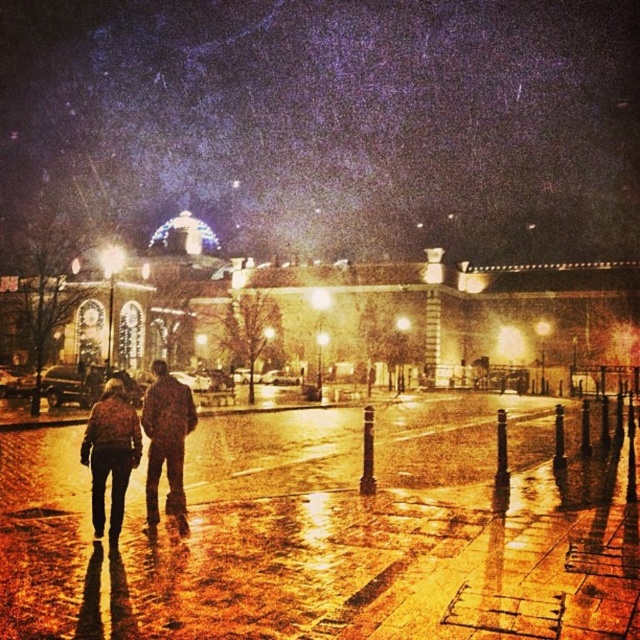
Find the location of a particular element. This screenshot has width=640, height=640. flannel shirt at center is located at coordinates (109, 454).

Can you confirm if flannel shirt at center is wider than dark brown leather jacket at center?

Correct, the width of flannel shirt at center exceeds that of dark brown leather jacket at center.

What do you see at coordinates (109, 454) in the screenshot? I see `flannel shirt at center` at bounding box center [109, 454].

This screenshot has width=640, height=640. I want to click on flannel shirt at center, so click(109, 454).

Who is taller, brown leather jacket at lower left or dark brown leather jacket at center?

dark brown leather jacket at center

Is brown leather jacket at lower left bigger than dark brown leather jacket at center?

Correct, brown leather jacket at lower left is larger in size than dark brown leather jacket at center.

Is point (136, 433) closer to camera compared to point (157, 392)?

That is True.

Locate an element on the screen. The width and height of the screenshot is (640, 640). brown leather jacket at lower left is located at coordinates click(109, 452).

Between flannel shirt at center and brown leather jacket at lower left, which one has more height?

flannel shirt at center

I want to click on flannel shirt at center, so click(109, 454).

Locate an element on the screen. flannel shirt at center is located at coordinates (109, 454).